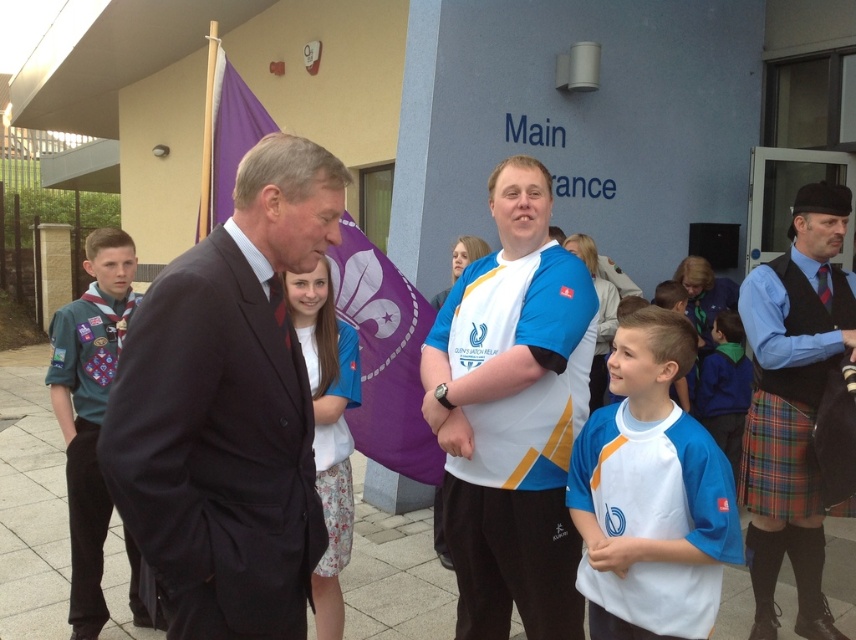
Does white matte shirt at center appear on the right side of white fabric shirt at center?

Correct, you'll find white matte shirt at center to the right of white fabric shirt at center.

The height and width of the screenshot is (640, 856). Describe the element at coordinates (651, 492) in the screenshot. I see `white matte shirt at center` at that location.

Image resolution: width=856 pixels, height=640 pixels. Find the location of `white matte shirt at center`. white matte shirt at center is located at coordinates (651, 492).

Who is higher up, dark suit at center or white jersey at center?

dark suit at center is higher up.

Does point (209, 461) lie in front of point (516, 600)?

Yes, it is.

At what (x,y) coordinates should I click in order to perform the action: click on dark suit at center. Please return your answer as a coordinate pair (x, y). The image size is (856, 640). Looking at the image, I should click on (229, 408).

Between white jersey at center and white matte shirt at center, which one is positioned lower?

white matte shirt at center is below.

Is point (518, 588) closer to viewer compared to point (690, 545)?

No.

You are a GUI agent. You are given a task and a screenshot of the screen. Output one action in this format:
    pyautogui.click(x=<x>, y=<y>)
    Task: Click on the white jersey at center
    
    Given the screenshot: What is the action you would take?
    pyautogui.click(x=512, y=416)